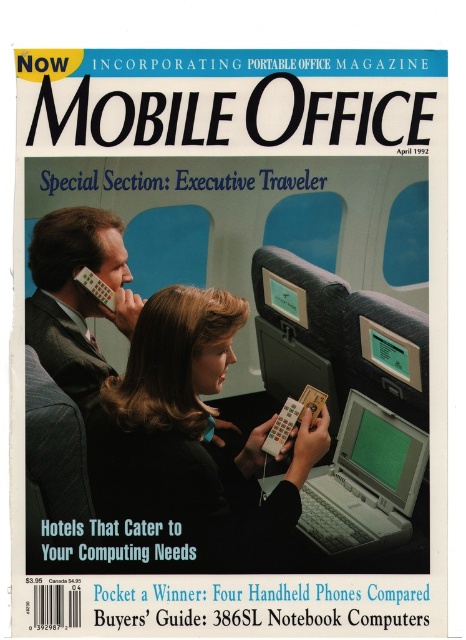
Question: Which of the following is the farthest from the observer?

Choices:
 (A) (139, 488)
 (B) (309, 502)

Answer: (B)

Question: Can you confirm if matte gray suit at left is bigger than gray plastic laptop at center?

Choices:
 (A) no
 (B) yes

Answer: (B)

Question: Which of the following is the farthest from the observer?

Choices:
 (A) (347, 472)
 (B) (68, 244)

Answer: (A)

Question: Which point appears closest to the camera in this image?

Choices:
 (A) (315, 461)
 (B) (378, 540)

Answer: (A)

Question: Does matte gray suit at left have a larger size compared to gray plastic laptop at center?

Choices:
 (A) no
 (B) yes

Answer: (B)

Question: Can you confirm if matte gray suit at left is positioned above gray plastic laptop at center?

Choices:
 (A) no
 (B) yes

Answer: (B)